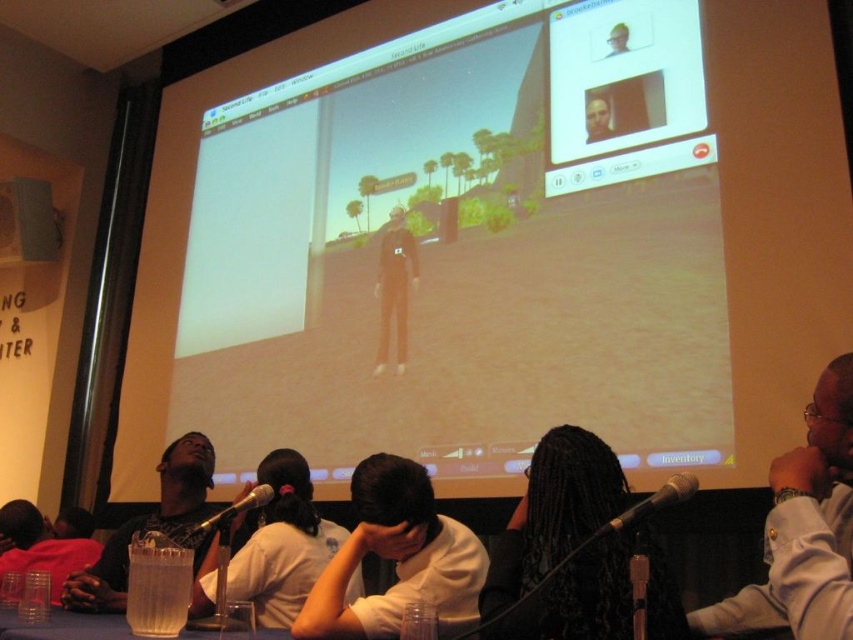
Question: Which point is farther from the camera taking this photo?

Choices:
 (A) (432, 600)
 (B) (664, 499)
 (C) (555, 241)

Answer: (C)

Question: Can you confirm if white matte shirt at center is bigger than metallic silver microphone at lower center?

Choices:
 (A) no
 (B) yes

Answer: (A)

Question: Which of the following is the farthest from the observer?

Choices:
 (A) matte black shirt at lower left
 (B) black hair at center
 (C) matte black screen at center

Answer: (C)

Question: Considering the relative positions of white matte shirt at center and metallic silver microphone at lower center in the image provided, where is white matte shirt at center located with respect to metallic silver microphone at lower center?

Choices:
 (A) below
 (B) above

Answer: (B)

Question: Which object is closer to the camera taking this photo?

Choices:
 (A) white matte shirt at lower right
 (B) black hair at center
 (C) matte black shirt at lower left

Answer: (A)

Question: Can you confirm if matte black screen at center is positioned to the left of metallic silver microphone at lower center?

Choices:
 (A) yes
 (B) no

Answer: (B)